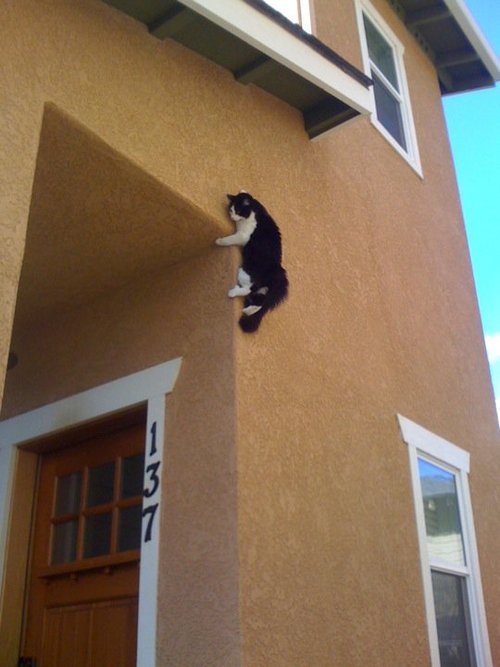
Locate an element on the screen. six pane door is located at coordinates (100, 507).